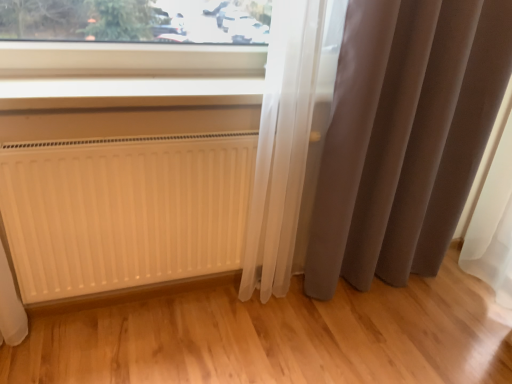
Question: Does matte gray curtain at right appear on the right side of white matte radiator at lower left?

Choices:
 (A) no
 (B) yes

Answer: (B)

Question: Is matte gray curtain at right smaller than white matte radiator at lower left?

Choices:
 (A) no
 (B) yes

Answer: (A)

Question: Is matte gray curtain at right bigger than white matte radiator at lower left?

Choices:
 (A) no
 (B) yes

Answer: (B)

Question: Can you confirm if matte gray curtain at right is shorter than white matte radiator at lower left?

Choices:
 (A) yes
 (B) no

Answer: (B)

Question: Considering the relative sizes of matte gray curtain at right and white matte radiator at lower left in the image provided, is matte gray curtain at right wider than white matte radiator at lower left?

Choices:
 (A) yes
 (B) no

Answer: (A)

Question: Is matte gray curtain at right looking in the opposite direction of white matte radiator at lower left?

Choices:
 (A) no
 (B) yes

Answer: (A)

Question: From the image's perspective, is matte gray curtain at right beneath white plastic window sill at upper center?

Choices:
 (A) yes
 (B) no

Answer: (A)

Question: Considering the relative sizes of matte gray curtain at right and white plastic window sill at upper center in the image provided, is matte gray curtain at right bigger than white plastic window sill at upper center?

Choices:
 (A) no
 (B) yes

Answer: (B)

Question: Could white plastic window sill at upper center be considered to be inside matte gray curtain at right?

Choices:
 (A) yes
 (B) no

Answer: (B)

Question: Does matte gray curtain at right have a greater height compared to white plastic window sill at upper center?

Choices:
 (A) no
 (B) yes

Answer: (B)

Question: Is matte gray curtain at right oriented away from white plastic window sill at upper center?

Choices:
 (A) no
 (B) yes

Answer: (A)

Question: Is matte gray curtain at right shorter than white plastic window sill at upper center?

Choices:
 (A) yes
 (B) no

Answer: (B)

Question: Is the position of white matte radiator at lower left less distant than that of matte gray curtain at right?

Choices:
 (A) yes
 (B) no

Answer: (B)